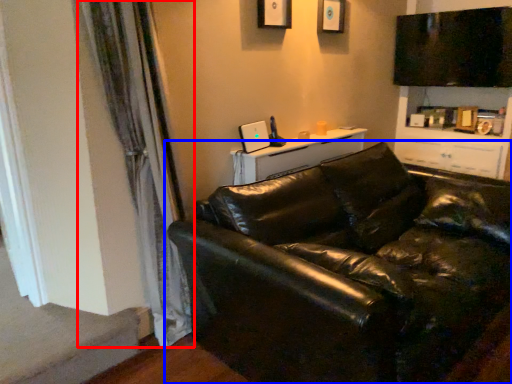
Question: Which point is closer to the camera, curtain (highlighted by a red box) or studio couch (highlighted by a blue box)?

Choices:
 (A) curtain
 (B) studio couch

Answer: (B)